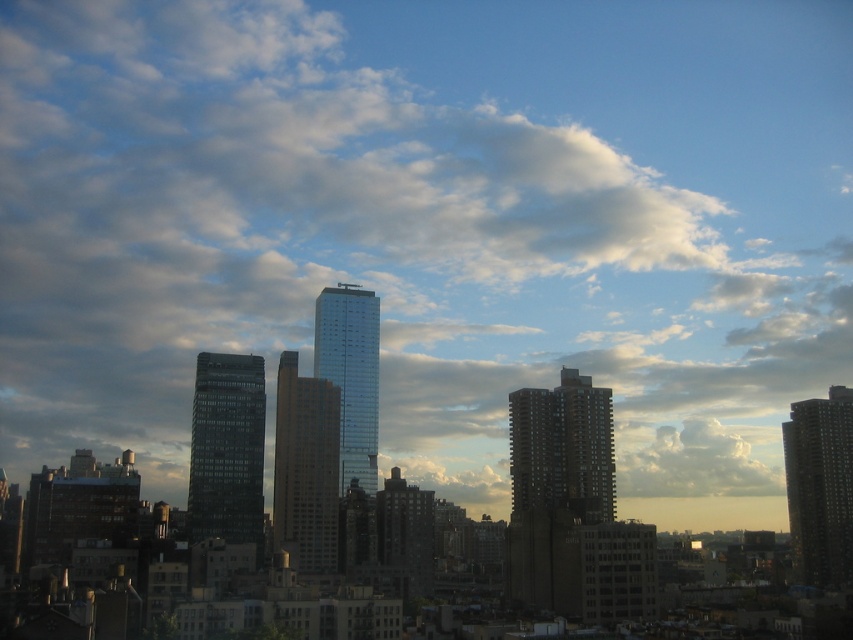
Question: Which of the following is the farthest from the observer?

Choices:
 (A) dark gray concrete building at center
 (B) glassy reflective skyscraper at center

Answer: (B)

Question: Which of the following is the farthest from the observer?

Choices:
 (A) (337, 292)
 (B) (314, 532)

Answer: (A)

Question: Can you confirm if dark gray concrete building at center is positioned to the left of matte glass skyscraper at center?

Choices:
 (A) yes
 (B) no

Answer: (B)

Question: Does matte glass skyscraper at center have a greater width compared to dark gray concrete building at right?

Choices:
 (A) yes
 (B) no

Answer: (B)

Question: Does dark gray concrete building at right appear on the left side of glassy reflective skyscraper at center?

Choices:
 (A) yes
 (B) no

Answer: (B)

Question: Which point is farther to the camera?

Choices:
 (A) glassy reflective skyscraper at center-left
 (B) dark gray concrete building at right
 (C) dark gray concrete building at center
 (D) matte glass skyscraper at center

Answer: (B)